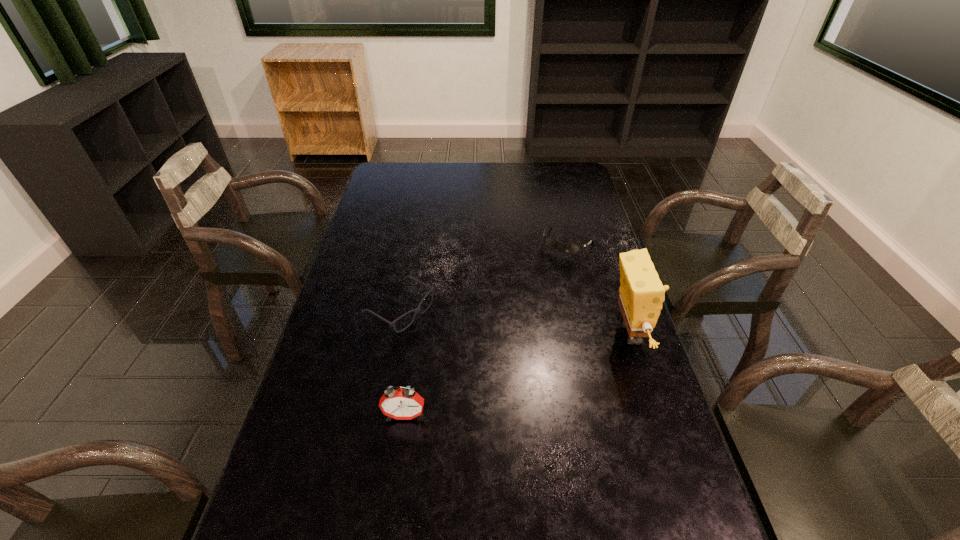
Locate an element on the screen. vacant space that is in between the sunglasses and the second tallest object is located at coordinates (487, 329).

This screenshot has height=540, width=960. Identify the location of free space between the farthest object and the nearest object. (487, 329).

This screenshot has height=540, width=960. In order to click on vacant space in between the spectacles and the sunglasses in this screenshot , I will do `click(484, 276)`.

Identify the location of free space that is in between the sponge and the sunglasses. (599, 288).

Identify the location of empty location between the spectacles and the sponge. (515, 322).

Locate an element on the screen. This screenshot has height=540, width=960. vacant point located between the sunglasses and the nearest object is located at coordinates pos(487,329).

The height and width of the screenshot is (540, 960). I want to click on free space between the farthest object and the second tallest object, so click(487, 329).

At what (x,y) coordinates should I click in order to perform the action: click on blank region between the sunglasses and the second tallest object. Please return your answer as a coordinate pair (x, y). The image size is (960, 540). Looking at the image, I should click on tap(487, 329).

Where is `blank region between the spectacles and the tallest object`? Image resolution: width=960 pixels, height=540 pixels. blank region between the spectacles and the tallest object is located at coordinates (x=515, y=322).

Select which object appears as the third closest to the alarm clock. Please provide its 2D coordinates. Your answer should be formatted as a tuple, i.e. [(x, y)], where the tuple contains the x and y coordinates of a point satisfying the conditions above.

[(570, 248)]